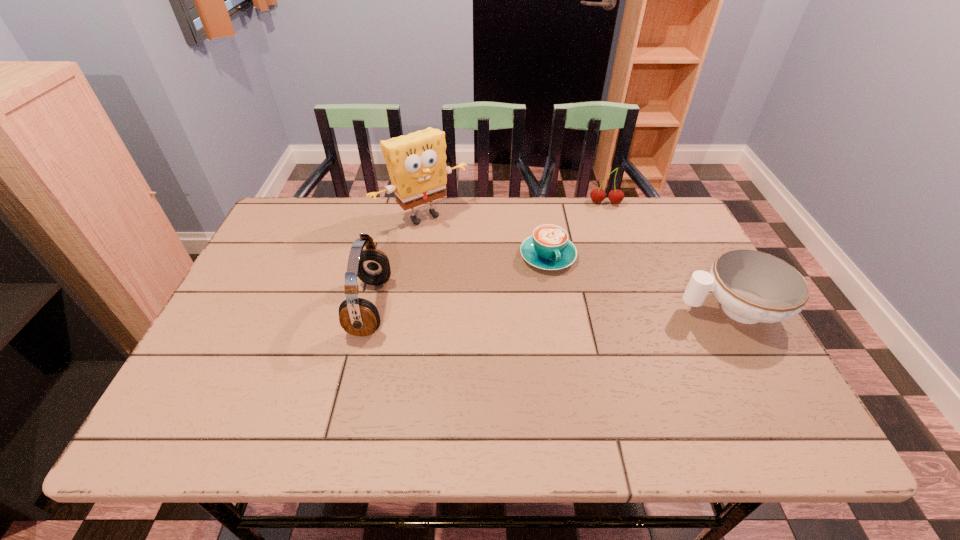
You are a GUI agent. You are given a task and a screenshot of the screen. Output one action in this format:
    pyautogui.click(x=<x>, y=<y>)
    Task: Click on the second tallest object
    
    Given the screenshot: What is the action you would take?
    pyautogui.click(x=357, y=316)

Locate an element on the screen. This screenshot has width=960, height=540. the rightmost object is located at coordinates (752, 286).

Where is `the second shortest object`? The height and width of the screenshot is (540, 960). the second shortest object is located at coordinates (752, 286).

I want to click on sponge, so click(x=416, y=162).

In order to click on cappuccino in this screenshot , I will do `click(548, 248)`.

Locate an element on the screen. The width and height of the screenshot is (960, 540). the third object from right to left is located at coordinates (548, 248).

What are the coordinates of `cherry` in the screenshot? It's located at (597, 195).

What are the coordinates of `free space located 0.150m on the ear cups of the fourth shortest object` in the screenshot? It's located at (448, 307).

Find the location of a particular element. free space located 0.250m on the side with the handle of the chinaware is located at coordinates (579, 309).

At what (x,y) coordinates should I click in order to perform the action: click on vacant position located on the side with the handle of the chinaware. Please return your answer as a coordinate pair (x, y). The image size is (960, 540). Looking at the image, I should click on (631, 309).